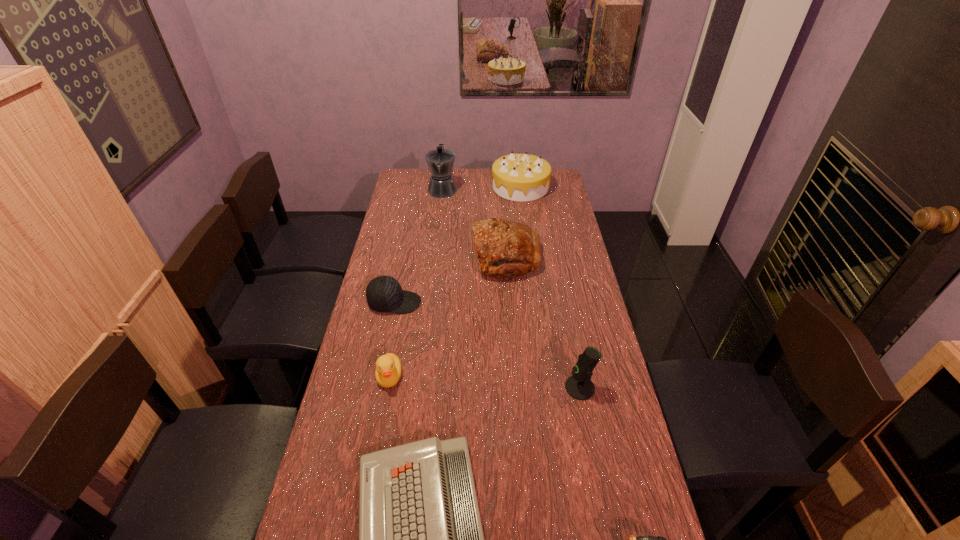
What are the coordinates of `blank space located at the sliced front of the third farthest object` in the screenshot? It's located at (415, 257).

Locate an element on the screen. This screenshot has width=960, height=540. vacant space situated 0.390m at the sliced front of the third farthest object is located at coordinates (378, 257).

This screenshot has width=960, height=540. I want to click on vacant area located at the front of the fifth nearest object where the brim is located, so click(x=468, y=302).

You are a GUI agent. You are given a task and a screenshot of the screen. Output one action in this format:
    pyautogui.click(x=<x>, y=<y>)
    Task: Click on the blank space located at the beak of the duck
    
    Given the screenshot: What is the action you would take?
    pyautogui.click(x=378, y=438)

Where is `coffeepot positioned at the far edge`? coffeepot positioned at the far edge is located at coordinates (440, 161).

The height and width of the screenshot is (540, 960). Find the location of `birthday cake that is at the far edge`. birthday cake that is at the far edge is located at coordinates (517, 177).

Identify the location of coffeepot that is at the left edge. (440, 161).

Identify the location of baseball cap at the left edge. (384, 294).

Identify the location of duck that is positioned at the left edge. (388, 367).

The width and height of the screenshot is (960, 540). I want to click on birthday cake that is at the right edge, so point(517,177).